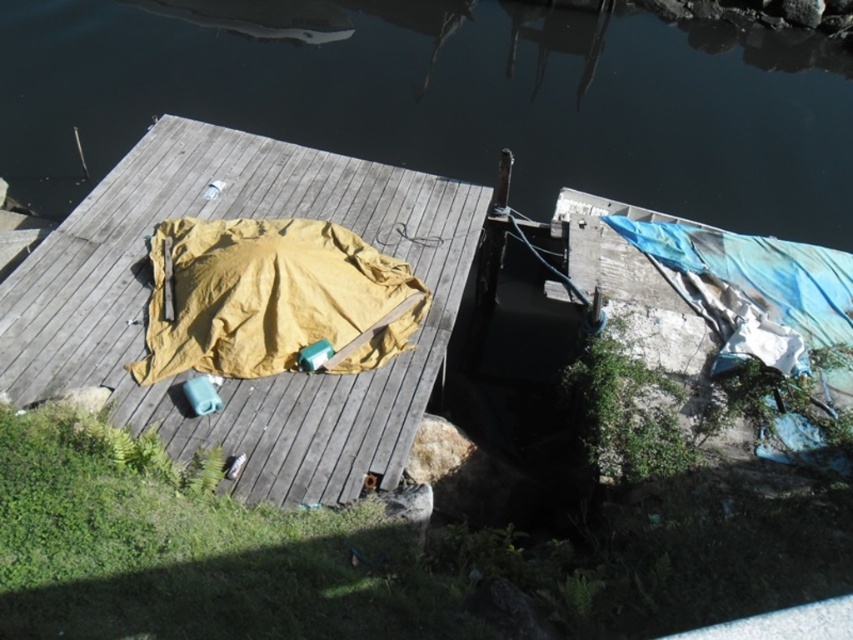
Question: Is transparent water at upper center wider than matte yellow tarp at center?

Choices:
 (A) no
 (B) yes

Answer: (B)

Question: Which point appears closest to the camera in this image?

Choices:
 (A) (55, 356)
 (B) (724, 172)

Answer: (A)

Question: Which of the following is the closest to the observer?

Choices:
 (A) (216, 140)
 (B) (225, 349)

Answer: (B)

Question: From the image, what is the correct spatial relationship of matte yellow tarp at center in relation to yellow fabric blanket at center?

Choices:
 (A) above
 (B) below

Answer: (B)

Question: Which object is closer to the camera taking this photo?

Choices:
 (A) matte yellow tarp at center
 (B) transparent water at upper center

Answer: (A)

Question: Is transparent water at upper center thinner than yellow fabric blanket at center?

Choices:
 (A) no
 (B) yes

Answer: (A)